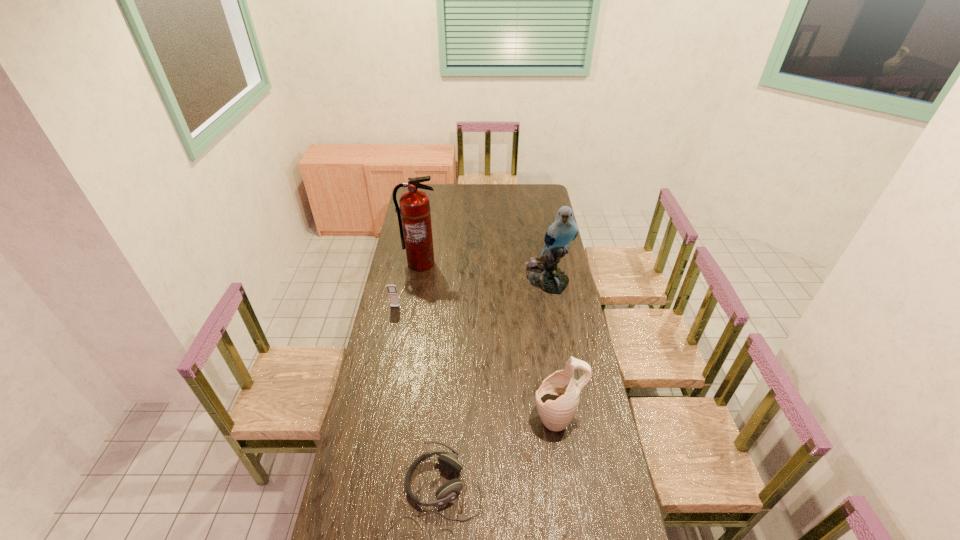
Locate an element on the screen. free spot located 0.240m at the spout of the pitcher is located at coordinates (469, 418).

Locate an element on the screen. This screenshot has height=540, width=960. vacant region located on the front-facing side of the cellular telephone is located at coordinates tap(390, 334).

Locate an element on the screen. fire extinguisher at the left edge is located at coordinates (414, 209).

This screenshot has height=540, width=960. In order to click on cellular telephone located at the left edge in this screenshot , I will do `click(392, 290)`.

Find the location of a particular element. parakeet at the right edge is located at coordinates click(x=542, y=272).

This screenshot has height=540, width=960. In order to click on pitcher positioned at the right edge in this screenshot , I will do `click(557, 399)`.

Where is `vacant space at the far edge`? The height and width of the screenshot is (540, 960). vacant space at the far edge is located at coordinates (451, 200).

The image size is (960, 540). What are the coordinates of `free space at the left edge of the desktop` in the screenshot? It's located at (383, 442).

Image resolution: width=960 pixels, height=540 pixels. In the image, there is a desktop. Find the location of `blank space at the right edge`. blank space at the right edge is located at coordinates (540, 238).

At what (x,y) coordinates should I click in order to perform the action: click on free space at the far right corner of the desktop. Please return your answer as a coordinate pair (x, y). The image size is (960, 540). Looking at the image, I should click on (548, 192).